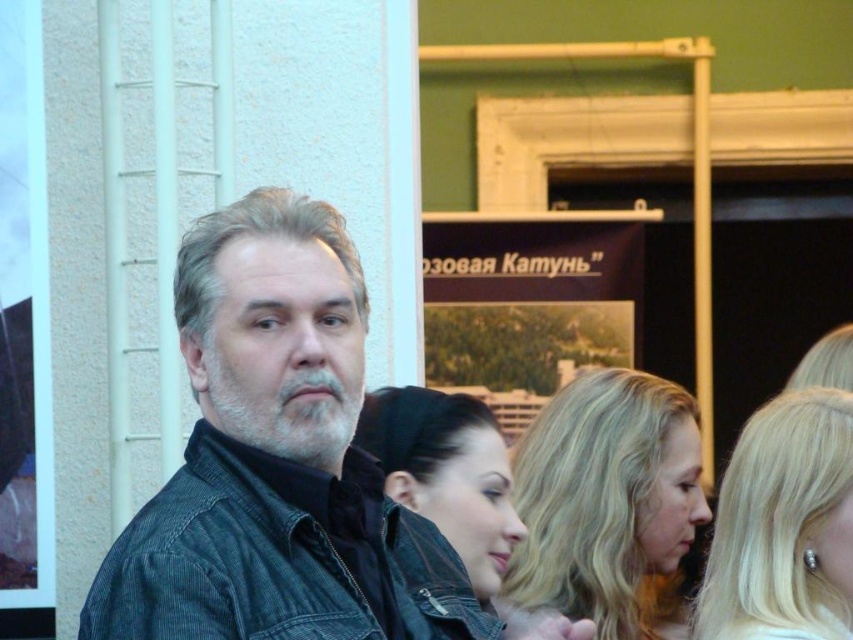
Question: From the image, what is the correct spatial relationship of denim jacket at center in relation to matte brown signboard at center?

Choices:
 (A) right
 (B) left

Answer: (B)

Question: Which point is closer to the camera taking this photo?

Choices:
 (A) (170, 480)
 (B) (814, 472)
 (C) (525, 605)
 (D) (639, 324)

Answer: (A)

Question: Which point is closer to the camera taking this photo?

Choices:
 (A) (424, 236)
 (B) (434, 480)
 (C) (613, 516)

Answer: (B)

Question: Estimate the real-world distances between objects in this image. Which object is farther from the matte brown signboard at center?

Choices:
 (A) blonde hair at center
 (B) graywoollybeard at center
 (C) denim jacket at center
 (D) smooth black hair at center

Answer: (B)

Question: Is the position of blonde hair at center more distant than that of graywoollybeard at center?

Choices:
 (A) yes
 (B) no

Answer: (A)

Question: Can you confirm if denim jacket at center is thinner than graywoollybeard at center?

Choices:
 (A) no
 (B) yes

Answer: (A)